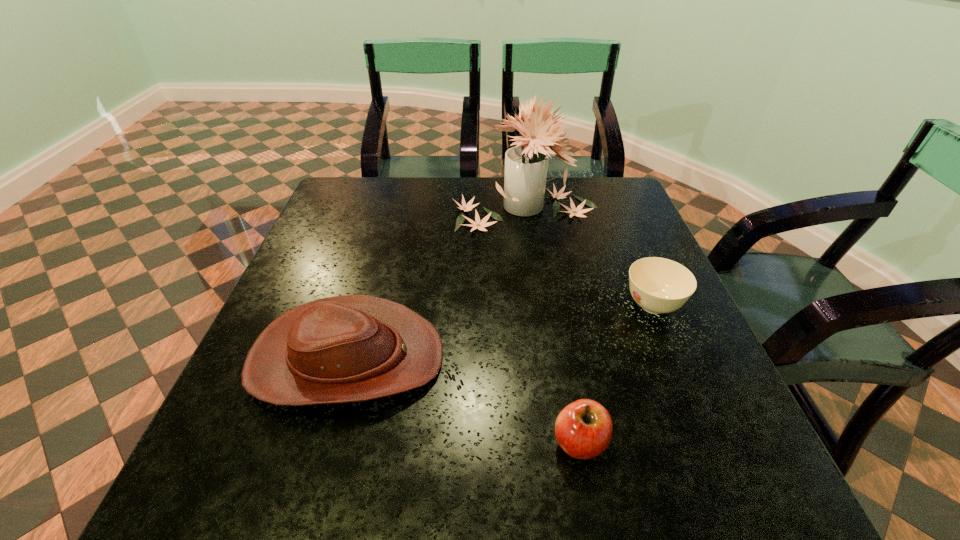
Identify the location of the farthest object. (526, 165).

This screenshot has height=540, width=960. What are the coordinates of `the tallest object` in the screenshot? It's located at (526, 165).

The width and height of the screenshot is (960, 540). Identify the location of cowboy hat. (352, 348).

At what (x,y) coordinates should I click in order to perform the action: click on apple. Please return your answer as a coordinate pair (x, y). Looking at the image, I should click on (583, 429).

This screenshot has height=540, width=960. I want to click on sugar bowl, so click(x=658, y=285).

You are a GUI agent. You are given a task and a screenshot of the screen. Output one action in this format:
    pyautogui.click(x=<x>, y=<y>)
    Task: Click on the vacant space located on the front of the farthest object
    The height and width of the screenshot is (540, 960).
    Given the screenshot: What is the action you would take?
    pyautogui.click(x=535, y=292)

Where is `free region located on the front-facing side of the cowboy hat`? The width and height of the screenshot is (960, 540). free region located on the front-facing side of the cowboy hat is located at coordinates (468, 359).

Locate an element on the screen. This screenshot has height=540, width=960. vacant space located on the left of the apple is located at coordinates (443, 442).

Image resolution: width=960 pixels, height=540 pixels. Find the location of `vacant space located 0.110m on the back of the sugar bowl`. vacant space located 0.110m on the back of the sugar bowl is located at coordinates (632, 255).

I want to click on object at the far edge, so click(526, 165).